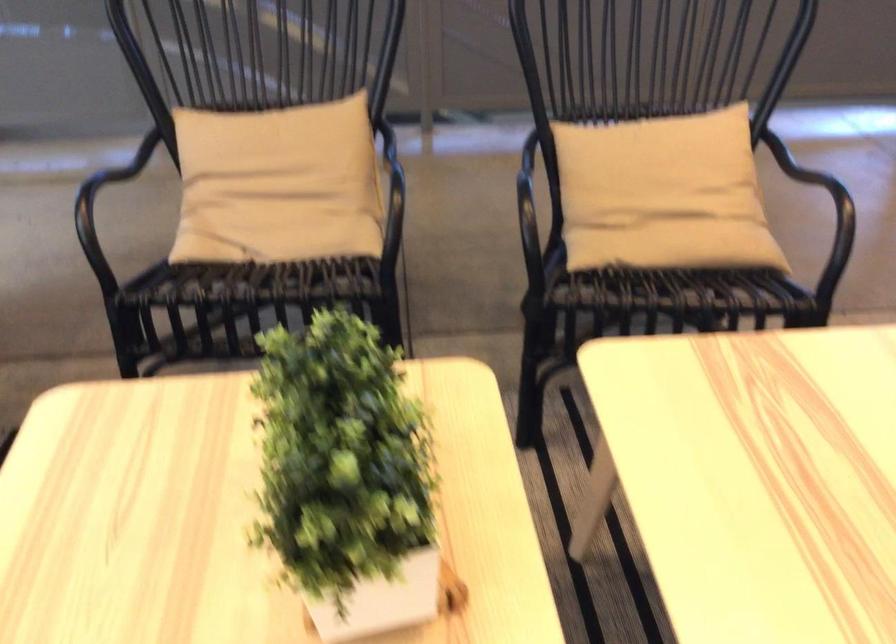
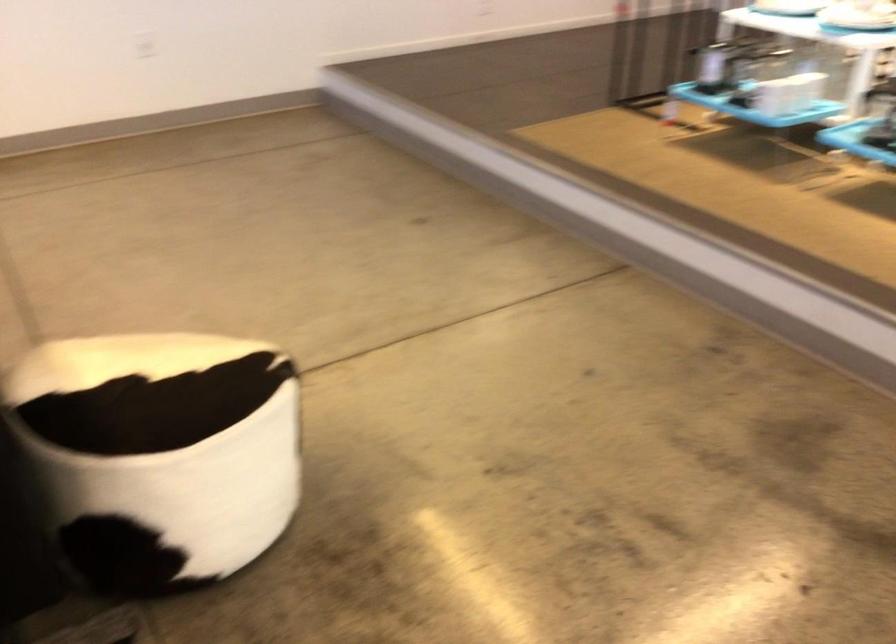
From the picture: First-person continuous shooting, in which direction is the camera rotating?

The rotation direction of the camera is right-down.